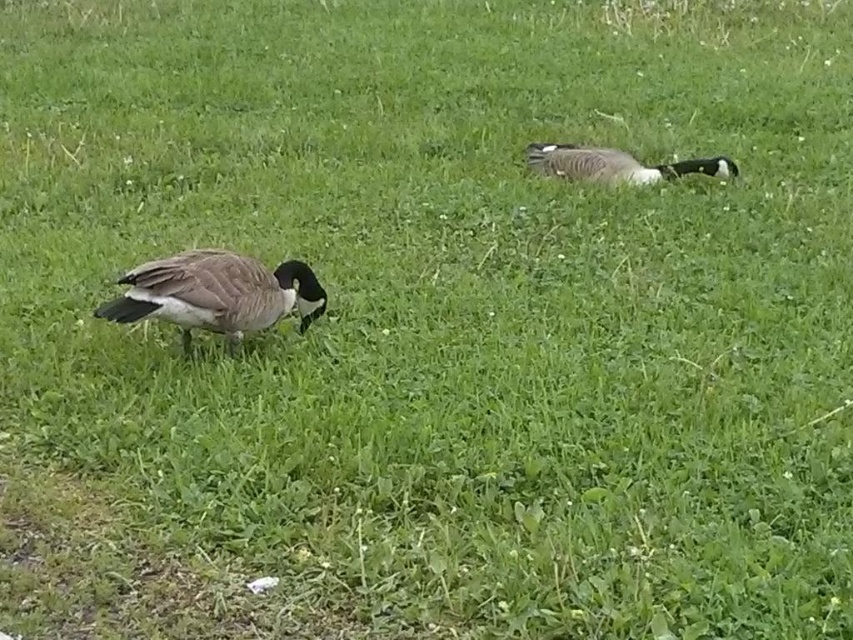
You are a birdwatcher trying to identify the taller duck between the brown feathered duck at left and the brown feathered duck at upper right. Which one is taller?

The brown feathered duck at left is much taller than the brown feathered duck at upper right.

You are a photographer trying to capture both brown feathered duck at left and brown feathered duck at upper right in a single frame. Which duck should you adjust your camera angle to include first if you want to ensure both are fully visible?

You should adjust your camera angle to include the brown feathered duck at left first because it is positioned to the left of the brown feathered duck at upper right, so capturing its position first ensures the frame can accommodate both.

You are a photographer trying to capture a clear photo of the brown feathered duck at left and the brown feathered duck at upper right. Which duck is closer to the camera and will appear larger in the photo?

The brown feathered duck at left is in front of the brown feathered duck at upper right, so it will appear closer and larger in the photo.